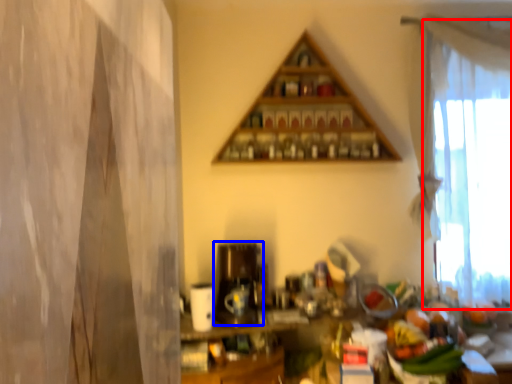
Question: Among these objects, which one is nearest to the camera, curtain (highlighted by a red box) or appliance (highlighted by a blue box)?

Choices:
 (A) curtain
 (B) appliance

Answer: (B)